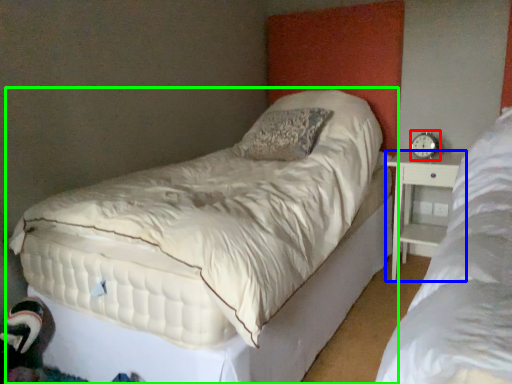
Question: Based on their relative distances, which object is nearer to alarm clock (highlighted by a red box)? Choose from nightstand (highlighted by a blue box) and bed (highlighted by a green box).

Choices:
 (A) nightstand
 (B) bed

Answer: (A)